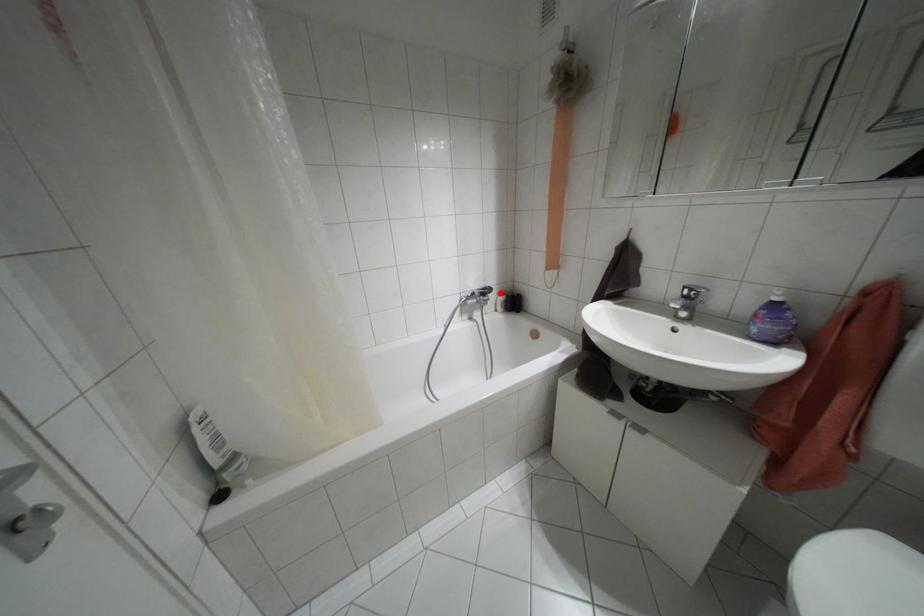
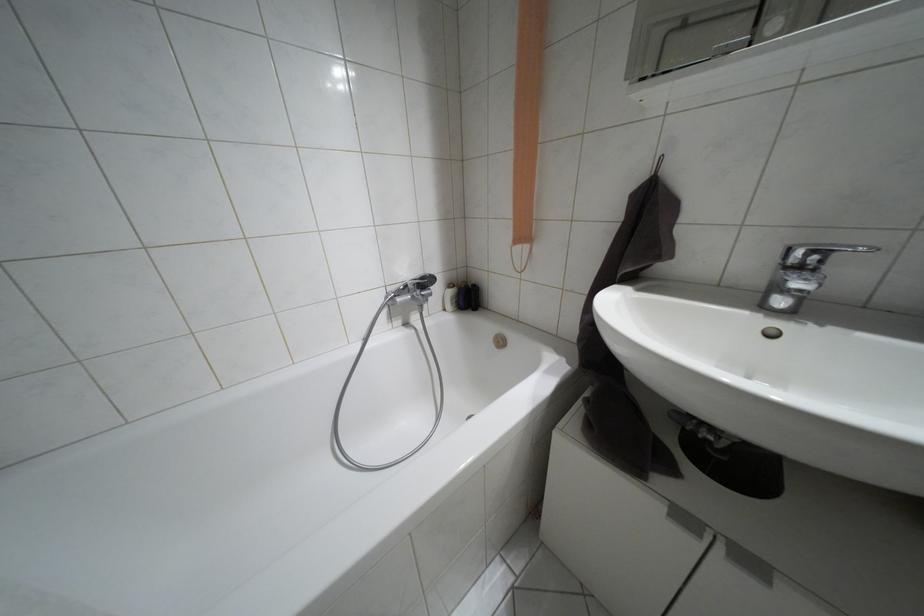
Locate, in the second image, the point that corresponds to the highlighted location in the first image.

(448, 285)